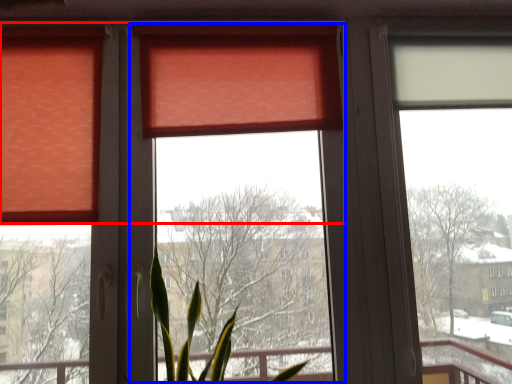
Question: Among these objects, which one is nearest to the camera, curtain (highlighted by a red box) or window screen (highlighted by a blue box)?

Choices:
 (A) curtain
 (B) window screen

Answer: (B)